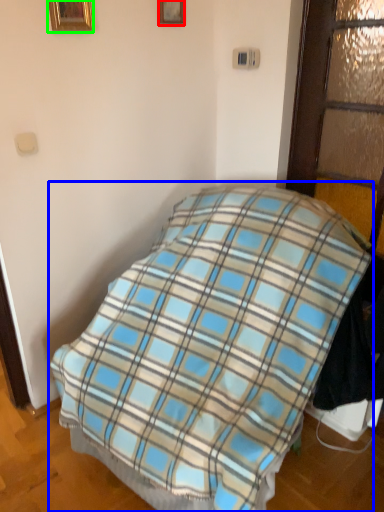
Question: Which object is the closest to the picture frame (highlighted by a red box)? Choose among these: bed (highlighted by a blue box) or picture frame (highlighted by a green box).

Choices:
 (A) bed
 (B) picture frame

Answer: (B)